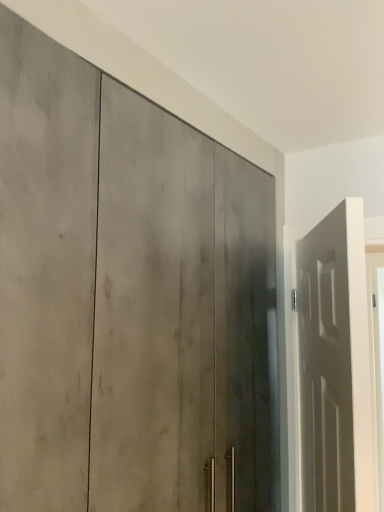
Measure the distance between point (317, 469) and camera.

Point (317, 469) and camera are 1.31 meters apart from each other.

The height and width of the screenshot is (512, 384). What are the coordinates of `white matte door at right, acting as the second door starting from the left` in the screenshot? It's located at (333, 364).

The height and width of the screenshot is (512, 384). What do you see at coordinates (333, 364) in the screenshot?
I see `white matte door at right, acting as the second door starting from the left` at bounding box center [333, 364].

Identify the location of matte gray door at center, which is counted as the 2th door, starting from the right. This screenshot has height=512, width=384. (99, 291).

How much space does matte gray door at center, which is counted as the 2th door, starting from the right, occupy horizontally?

28.36 inches.

The width and height of the screenshot is (384, 512). What do you see at coordinates (99, 291) in the screenshot? I see `matte gray door at center, acting as the first door starting from the left` at bounding box center [99, 291].

You are a GUI agent. You are given a task and a screenshot of the screen. Output one action in this format:
    pyautogui.click(x=<x>, y=<y>)
    Task: Click on the white matte door at right, acting as the second door starting from the left
    The width and height of the screenshot is (384, 512).
    Given the screenshot: What is the action you would take?
    pyautogui.click(x=333, y=364)

Which is more to the right, white matte door at right, acting as the second door starting from the left, or matte gray door at center, acting as the first door starting from the left?

From the viewer's perspective, white matte door at right, acting as the second door starting from the left, appears more on the right side.

Relative to matte gray door at center, acting as the first door starting from the left, is white matte door at right, acting as the second door starting from the left, in front or behind?

white matte door at right, acting as the second door starting from the left, is behind matte gray door at center, acting as the first door starting from the left.

Is point (326, 379) closer to viewer compared to point (74, 161)?

No, it is not.

From the image's perspective, would you say white matte door at right, positioned as the first door in right-to-left order, is positioned over matte gray door at center, acting as the first door starting from the left?

No, from the image's perspective, white matte door at right, positioned as the first door in right-to-left order, is not over matte gray door at center, acting as the first door starting from the left.

From a real-world perspective, between white matte door at right, acting as the second door starting from the left, and matte gray door at center, which is counted as the 2th door, starting from the right, who is vertically lower?

From a 3D spatial view, white matte door at right, acting as the second door starting from the left, is below.

Considering the sizes of objects white matte door at right, positioned as the first door in right-to-left order, and matte gray door at center, which is counted as the 2th door, starting from the right, in the image provided, who is thinner, white matte door at right, positioned as the first door in right-to-left order, or matte gray door at center, which is counted as the 2th door, starting from the right,?

white matte door at right, positioned as the first door in right-to-left order, is thinner.

Looking at this image, which of these two, white matte door at right, positioned as the first door in right-to-left order, or matte gray door at center, acting as the first door starting from the left, stands taller?

matte gray door at center, acting as the first door starting from the left.

Does white matte door at right, positioned as the first door in right-to-left order, have a larger size compared to matte gray door at center, acting as the first door starting from the left?

No, white matte door at right, positioned as the first door in right-to-left order, is not bigger than matte gray door at center, acting as the first door starting from the left.

Is white matte door at right, acting as the second door starting from the left, surrounding matte gray door at center, which is counted as the 2th door, starting from the right?

No, matte gray door at center, which is counted as the 2th door, starting from the right, is not inside white matte door at right, acting as the second door starting from the left.

Is the surface of white matte door at right, acting as the second door starting from the left, in direct contact with matte gray door at center, acting as the first door starting from the left?

No, white matte door at right, acting as the second door starting from the left, is not with matte gray door at center, acting as the first door starting from the left.

Is white matte door at right, positioned as the first door in right-to-left order, turned away from matte gray door at center, acting as the first door starting from the left?

Yes.

Locate an element on the screen. This screenshot has width=384, height=512. door below the matte gray door at center, which is counted as the 2th door, starting from the right (from a real-world perspective) is located at coordinates (333, 364).

Which object is positioned more to the left, matte gray door at center, acting as the first door starting from the left, or white matte door at right, acting as the second door starting from the left?

matte gray door at center, acting as the first door starting from the left, is more to the left.

Does matte gray door at center, which is counted as the 2th door, starting from the right, come behind white matte door at right, acting as the second door starting from the left?

No, matte gray door at center, which is counted as the 2th door, starting from the right, is in front of white matte door at right, acting as the second door starting from the left.

Is point (158, 312) positioned behind point (305, 257)?

No, it is not.

From the image's perspective, would you say matte gray door at center, acting as the first door starting from the left, is shown under white matte door at right, positioned as the first door in right-to-left order?

No, from the image's perspective, matte gray door at center, acting as the first door starting from the left, is not below white matte door at right, positioned as the first door in right-to-left order.

From a real-world perspective, is matte gray door at center, which is counted as the 2th door, starting from the right, positioned over white matte door at right, acting as the second door starting from the left, based on gravity?

Yes, from a real-world perspective, matte gray door at center, which is counted as the 2th door, starting from the right, is on top of white matte door at right, acting as the second door starting from the left.

Which of these two, matte gray door at center, acting as the first door starting from the left, or white matte door at right, acting as the second door starting from the left, is thinner?

Thinner between the two is white matte door at right, acting as the second door starting from the left.

Is matte gray door at center, acting as the first door starting from the left, taller or shorter than white matte door at right, acting as the second door starting from the left?

matte gray door at center, acting as the first door starting from the left, is taller than white matte door at right, acting as the second door starting from the left.

Considering the sizes of objects matte gray door at center, acting as the first door starting from the left, and white matte door at right, positioned as the first door in right-to-left order, in the image provided, who is smaller, matte gray door at center, acting as the first door starting from the left, or white matte door at right, positioned as the first door in right-to-left order,?

white matte door at right, positioned as the first door in right-to-left order.

Is matte gray door at center, acting as the first door starting from the left, not within white matte door at right, positioned as the first door in right-to-left order?

Yes, matte gray door at center, acting as the first door starting from the left, is located beyond the bounds of white matte door at right, positioned as the first door in right-to-left order.

Does matte gray door at center, acting as the first door starting from the left, touch white matte door at right, positioned as the first door in right-to-left order?

No, matte gray door at center, acting as the first door starting from the left, is not touching white matte door at right, positioned as the first door in right-to-left order.

Based on the photo, is matte gray door at center, which is counted as the 2th door, starting from the right, positioned with its back to white matte door at right, positioned as the first door in right-to-left order?

Yes, matte gray door at center, which is counted as the 2th door, starting from the right, is facing away from white matte door at right, positioned as the first door in right-to-left order.

What's the angular difference between matte gray door at center, which is counted as the 2th door, starting from the right, and white matte door at right, positioned as the first door in right-to-left order,'s facing directions?

There is a 25.5-degree angle between the facing directions of matte gray door at center, which is counted as the 2th door, starting from the right, and white matte door at right, positioned as the first door in right-to-left order.

How far apart are matte gray door at center, which is counted as the 2th door, starting from the right, and white matte door at right, acting as the second door starting from the left?

They are 16.17 inches apart.

Find the location of a particular element. door located above the white matte door at right, acting as the second door starting from the left (from a real-world perspective) is located at coordinates (99, 291).

The image size is (384, 512). What are the coordinates of `door lying on the right of matte gray door at center, acting as the first door starting from the left` in the screenshot? It's located at (333, 364).

Locate an element on the screen. The height and width of the screenshot is (512, 384). door behind the matte gray door at center, which is counted as the 2th door, starting from the right is located at coordinates (333, 364).